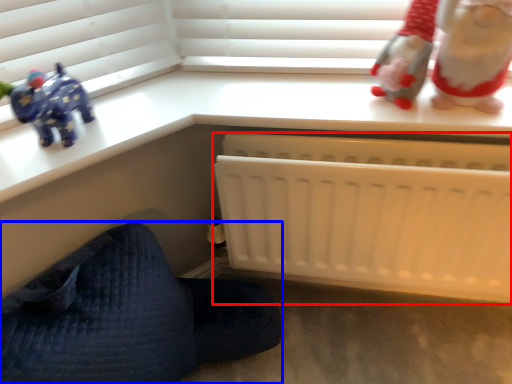
Question: Which point is closer to the camera, infant bed (highlighted by a red box) or furniture (highlighted by a blue box)?

Choices:
 (A) infant bed
 (B) furniture

Answer: (B)